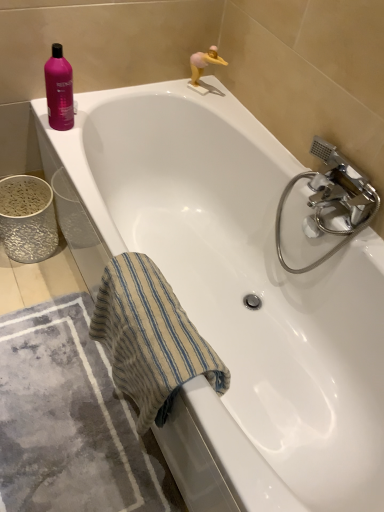
This screenshot has width=384, height=512. I want to click on free location in front of pink glossy shampoo at upper left, so click(x=67, y=145).